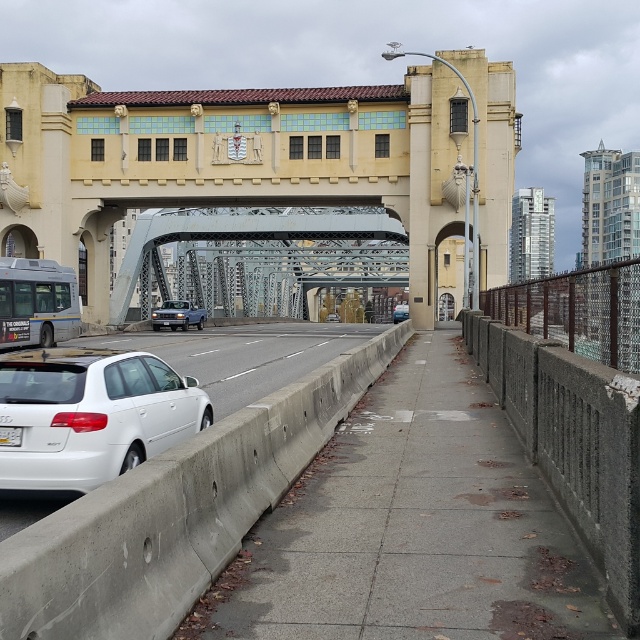
Describe the element at coordinates (90, 416) in the screenshot. I see `white matte hatchback at lower left` at that location.

Does white matte hatchback at lower left appear on the left side of matte black sedan at center?

Correct, you'll find white matte hatchback at lower left to the left of matte black sedan at center.

Is point (28, 368) positioned before point (396, 314)?

Yes, point (28, 368) is closer to viewer.

Locate an element on the screen. This screenshot has width=640, height=640. white matte hatchback at lower left is located at coordinates (90, 416).

Is metallic gray bridge at center wider than matte black sedan at center?

Correct, the width of metallic gray bridge at center exceeds that of matte black sedan at center.

Can you confirm if metallic gray bridge at center is positioned to the left of matte black sedan at center?

Correct, you'll find metallic gray bridge at center to the left of matte black sedan at center.

Does point (163, 241) lie in front of point (397, 308)?

Yes, it is.

Where is `metallic gray bridge at center`? The width and height of the screenshot is (640, 640). metallic gray bridge at center is located at coordinates (232, 237).

Can you confirm if metallic gray bridge at center is positioned to the left of white matte sedan at center?

Yes, metallic gray bridge at center is to the left of white matte sedan at center.

Who is positioned more to the left, metallic gray bridge at center or white matte sedan at center?

metallic gray bridge at center is more to the left.

Is point (115, 289) positioned in front of point (339, 321)?

Yes.

The image size is (640, 640). I want to click on metallic gray bridge at center, so click(x=232, y=237).